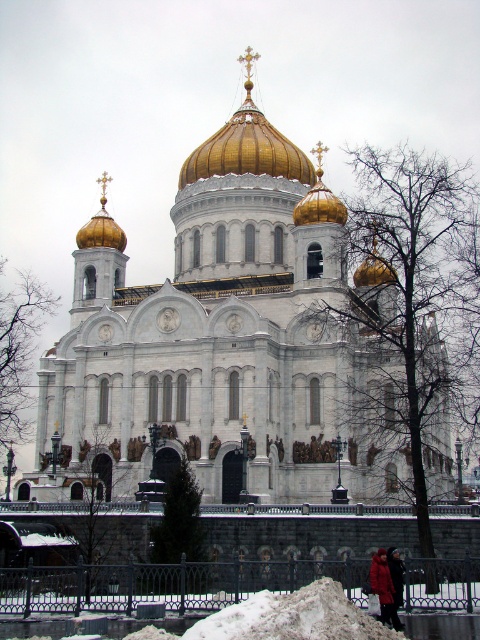
Can you confirm if white marble church at center is shorter than gold polished dome at center?

In fact, white marble church at center may be taller than gold polished dome at center.

Between white marble church at center and gold polished dome at center, which one is positioned higher?

gold polished dome at center

Who is more forward, (268,248) or (224,173)?

Point (268,248)

I want to click on white marble church at center, so click(x=222, y=340).